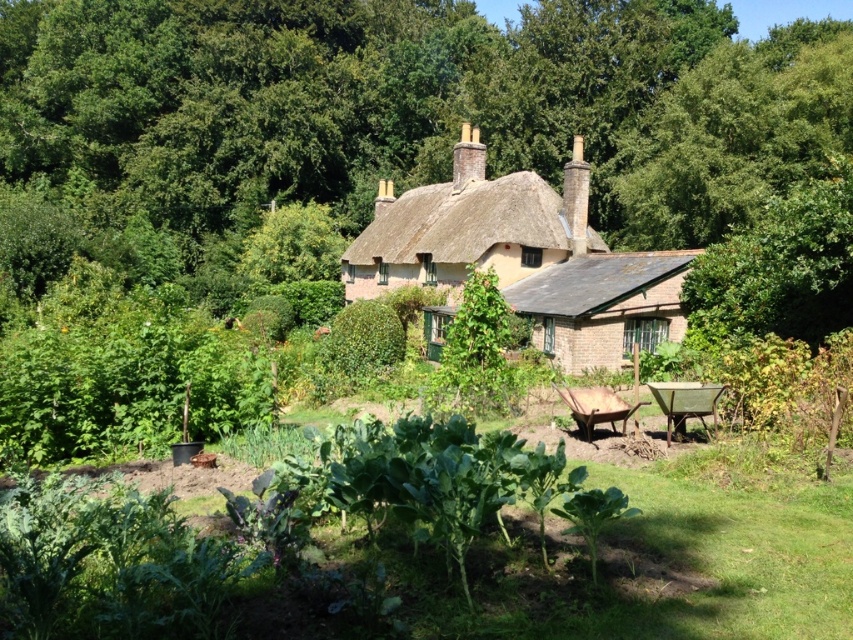
Question: Is green leafy vegetables at center above brick cottage at center?

Choices:
 (A) no
 (B) yes

Answer: (A)

Question: Is green leafy tree at center behind green leafy vegetables at center?

Choices:
 (A) no
 (B) yes

Answer: (B)

Question: Estimate the real-world distances between objects in this image. Which object is farther from the green leafy vegetables at center?

Choices:
 (A) green leafy tree at center
 (B) brick cottage at center

Answer: (A)

Question: Which object appears farthest from the camera in this image?

Choices:
 (A) green leafy vegetables at center
 (B) brick cottage at center
 (C) green leafy tree at center

Answer: (C)

Question: Among these objects, which one is farthest from the camera?

Choices:
 (A) brick cottage at center
 (B) green leafy tree at center
 (C) green leafy vegetables at center

Answer: (B)

Question: Is green leafy tree at center bigger than brick cottage at center?

Choices:
 (A) yes
 (B) no

Answer: (A)